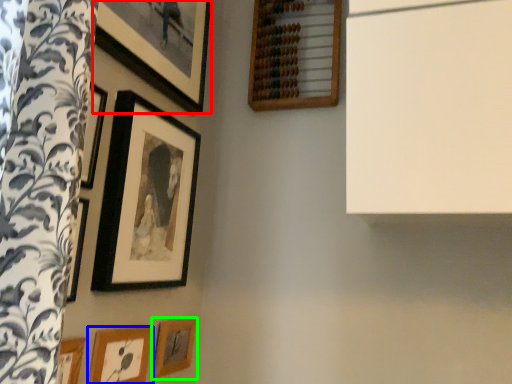
Question: Based on their relative distances, which object is nearer to picture frame (highlighted by a red box)? Choose from picture frame (highlighted by a blue box) and picture frame (highlighted by a green box).

Choices:
 (A) picture frame
 (B) picture frame

Answer: (A)